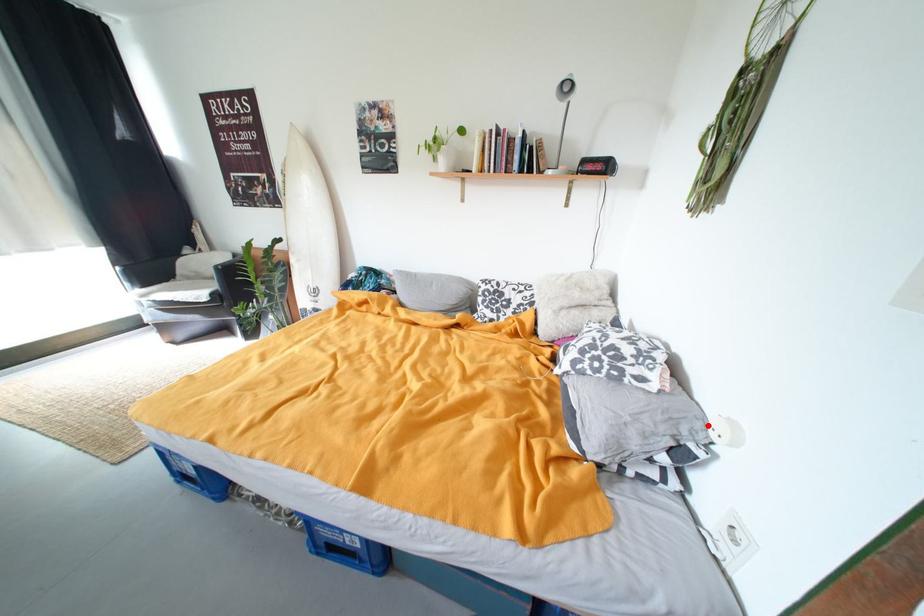
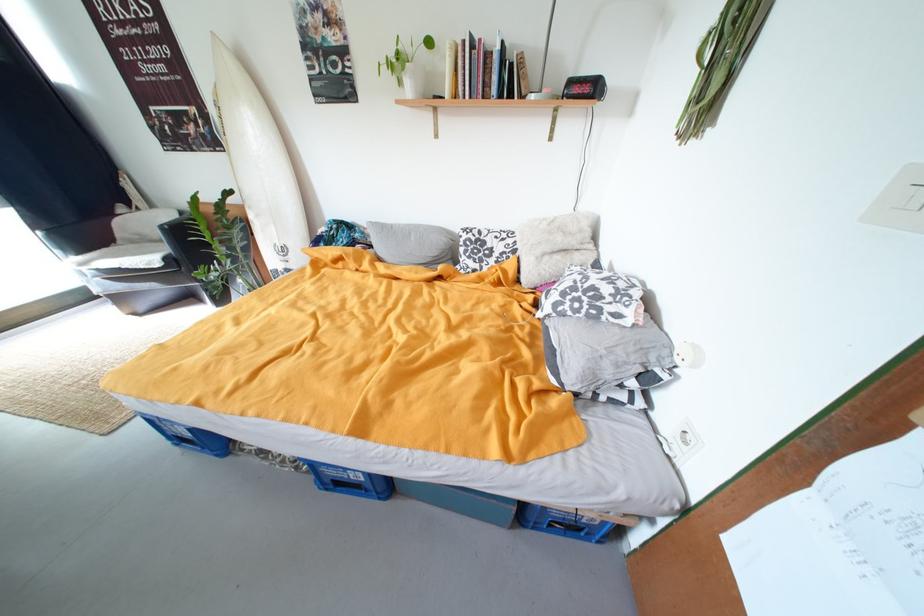
Question: I am providing you with two images of the same scene from different viewpoints. A red point is marked on the first image. At the location where the point appears in image 1, is it still visible in image 2?

Choices:
 (A) Yes
 (B) No

Answer: (A)